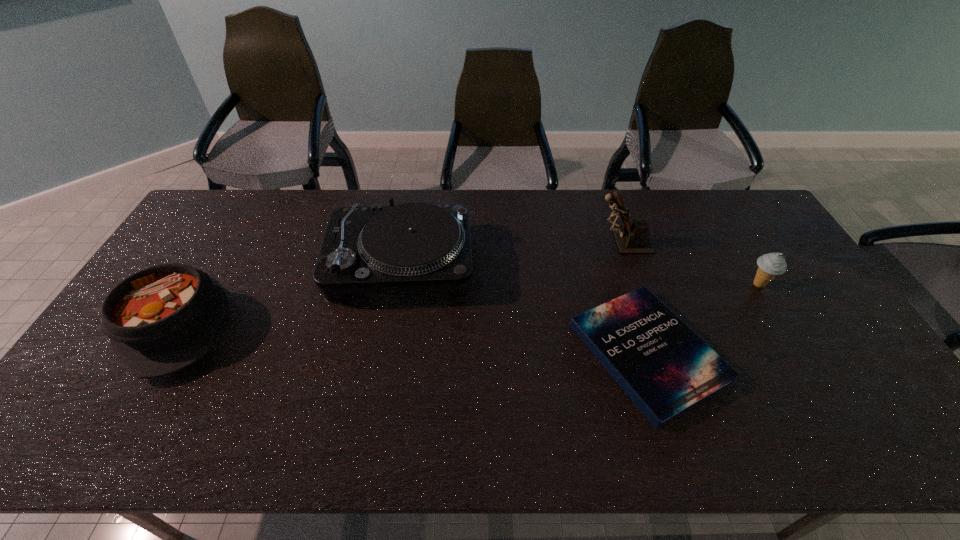
In the image, there is a desktop. At what (x,y) coordinates should I click in order to perform the action: click on free space at the right edge. Please return your answer as a coordinate pair (x, y). This screenshot has width=960, height=540. Looking at the image, I should click on (833, 330).

You are a GUI agent. You are given a task and a screenshot of the screen. Output one action in this format:
    pyautogui.click(x=<x>, y=<y>)
    Task: Click on the free space that is in between the hardback book and the record player
    The height and width of the screenshot is (540, 960).
    Given the screenshot: What is the action you would take?
    pyautogui.click(x=524, y=307)

The height and width of the screenshot is (540, 960). Find the location of `vacant area between the icecream and the shortest object`. vacant area between the icecream and the shortest object is located at coordinates (704, 319).

The image size is (960, 540). Find the location of `free space between the second object from left to right and the shortest object`. free space between the second object from left to right and the shortest object is located at coordinates (524, 307).

Identify the location of free spot between the second object from left to right and the tallest object. (512, 252).

I want to click on vacant area between the figurine and the record player, so click(512, 252).

Image resolution: width=960 pixels, height=540 pixels. I want to click on free point between the rightmost object and the shortest object, so click(704, 319).

Image resolution: width=960 pixels, height=540 pixels. Identify the location of free space between the icecream and the second object from left to right. (580, 273).

At what (x,y) coordinates should I click in order to perform the action: click on free spot between the icecream and the casserole. Please return your answer as a coordinate pair (x, y). Looking at the image, I should click on tap(468, 305).

Where is `blank region between the fourth object from right to left and the figurine`? The image size is (960, 540). blank region between the fourth object from right to left and the figurine is located at coordinates (512, 252).